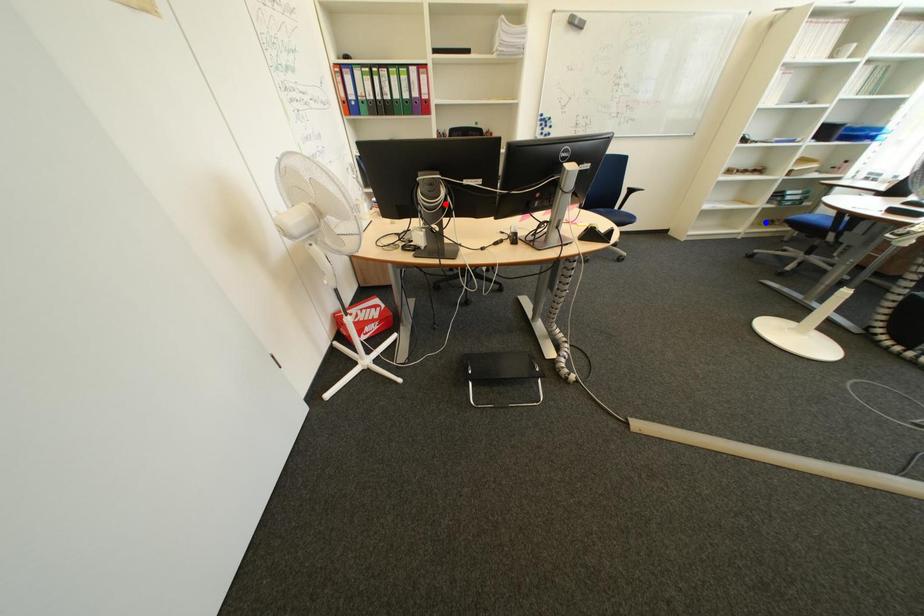
Question: In the image, two points are highlighted. Which point is nearer to the camera? Reply with the corresponding letter.

Choices:
 (A) blue point
 (B) red point

Answer: (B)